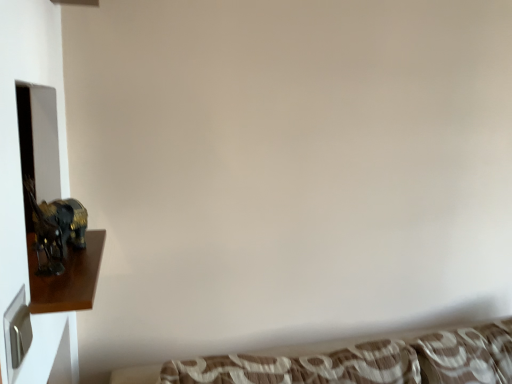
Question: From a real-world perspective, is brown textured fabric at lower center physically located above or below shiny gold statue at left?

Choices:
 (A) below
 (B) above

Answer: (A)

Question: Considering the positions of brown textured fabric at lower center and shiny gold statue at left in the image, is brown textured fabric at lower center wider or thinner than shiny gold statue at left?

Choices:
 (A) wide
 (B) thin

Answer: (A)

Question: Is brown textured fabric at lower center spatially inside shiny gold statue at left, or outside of it?

Choices:
 (A) inside
 (B) outside

Answer: (B)

Question: Does point (87, 304) appear closer or farther from the camera than point (373, 347)?

Choices:
 (A) farther
 (B) closer

Answer: (B)

Question: Choose the correct answer: Is shiny gold statue at left inside brown textured fabric at lower center or outside it?

Choices:
 (A) inside
 (B) outside

Answer: (B)

Question: From the image's perspective, relative to brown textured fabric at lower center, is shiny gold statue at left above or below?

Choices:
 (A) below
 (B) above

Answer: (B)

Question: Considering their positions, is shiny gold statue at left located in front of or behind brown textured fabric at lower center?

Choices:
 (A) behind
 (B) front

Answer: (B)